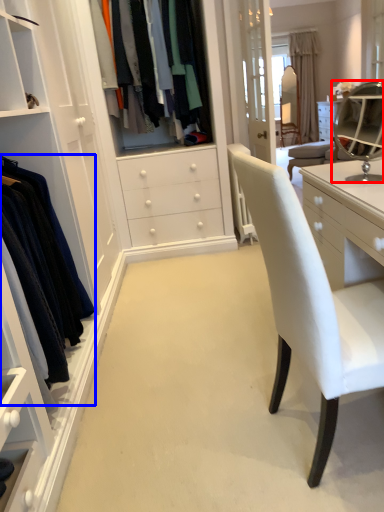
Question: Which point is further to the camera, mirror (highlighted by a red box) or clothing (highlighted by a blue box)?

Choices:
 (A) mirror
 (B) clothing

Answer: (A)